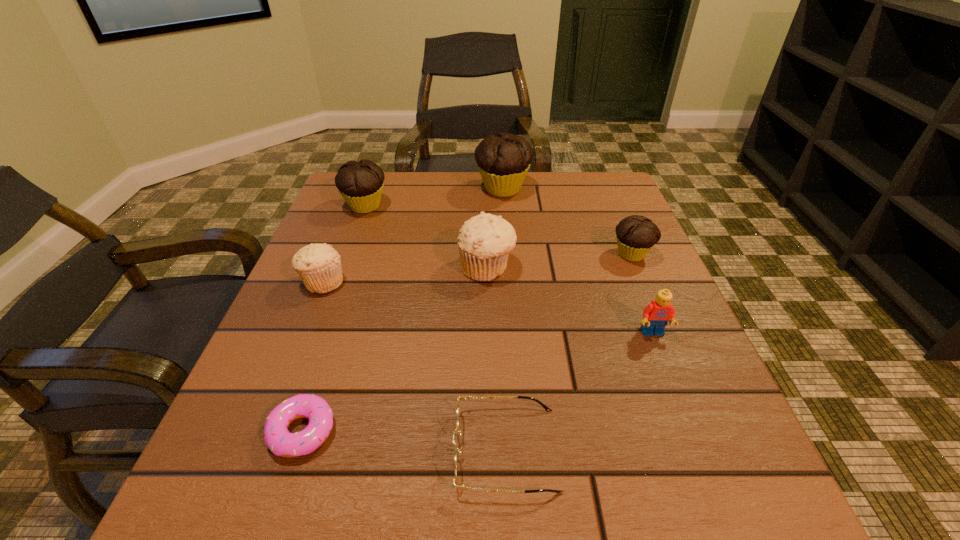
Identify the location of vacant space located 0.240m on the lenses of the spectacles. The image size is (960, 540). (283, 449).

The width and height of the screenshot is (960, 540). I want to click on vacant space located 0.090m on the back of the doughnut, so click(326, 356).

Identify the location of object that is positioned at the near edge. (465, 398).

At what (x,y) coordinates should I click in order to perform the action: click on doughnut present at the left edge. Please return your answer as a coordinate pair (x, y). Looking at the image, I should click on (278, 439).

I want to click on Lego that is at the right edge, so click(x=656, y=315).

The image size is (960, 540). I want to click on muffin that is at the right edge, so click(x=636, y=235).

I want to click on object located in the far left corner section of the desktop, so click(360, 183).

Locate an element on the screen. The height and width of the screenshot is (540, 960). free space at the far edge is located at coordinates (431, 176).

In the image, there is a desktop. Where is `free space at the near edge`? The image size is (960, 540). free space at the near edge is located at coordinates (423, 475).

In order to click on vacant space at the left edge of the desktop in this screenshot , I will do `click(278, 388)`.